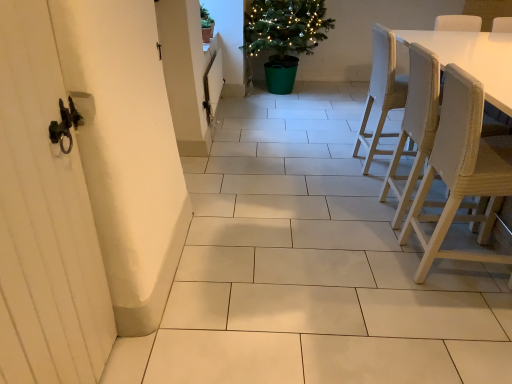
The width and height of the screenshot is (512, 384). What are the coordinates of `green matte pot at upper center, which is counted as the first houseplant, starting from the left` in the screenshot? It's located at (206, 25).

Locate an element on the screen. The height and width of the screenshot is (384, 512). light beige fabric chair at right, which is counted as the first chair, starting from the back is located at coordinates (381, 93).

What do you see at coordinates (44, 220) in the screenshot? The image size is (512, 384). I see `white wooden screen door at left` at bounding box center [44, 220].

Image resolution: width=512 pixels, height=384 pixels. What do you see at coordinates (462, 172) in the screenshot? I see `woven wood chair at right, marked as the 1th chair in a front-to-back arrangement` at bounding box center [462, 172].

What is the approximate width of light brown woven chair at right, which is the second chair from back to front?

20.02 inches.

Identify the location of light brown woven chair at right, which is counted as the 2th chair, starting from the front. This screenshot has width=512, height=384. (415, 126).

Locate an element on the screen. Image resolution: width=512 pixels, height=384 pixels. green plastic potted plant at upper center, which is the 1th houseplant in right-to-left order is located at coordinates (284, 36).

Where is `green matte pot at upper center, which is the 2th houseplant from back to front`? green matte pot at upper center, which is the 2th houseplant from back to front is located at coordinates (206, 25).

Who is smaller, light beige fabric chair at right, the 3th chair viewed from the front, or white wooden screen door at left?

With smaller size is white wooden screen door at left.

This screenshot has height=384, width=512. I want to click on the 1st chair to the right of the white wooden screen door at left, counting from the anchor's position, so click(381, 93).

How different are the orientations of light beige fabric chair at right, which is counted as the first chair, starting from the back, and white wooden screen door at left in degrees?

The angular difference between light beige fabric chair at right, which is counted as the first chair, starting from the back, and white wooden screen door at left is 2.22 degrees.

Can you confirm if green plastic potted plant at upper center, which is the 1th houseplant in right-to-left order, is taller than light beige fabric chair at right, the 3th chair viewed from the front?

Indeed, green plastic potted plant at upper center, which is the 1th houseplant in right-to-left order, has a greater height compared to light beige fabric chair at right, the 3th chair viewed from the front.

Does green plastic potted plant at upper center, placed as the second houseplant when sorted from left to right, turn towards light beige fabric chair at right, the 3th chair viewed from the front?

Yes, green plastic potted plant at upper center, placed as the second houseplant when sorted from left to right, is facing light beige fabric chair at right, the 3th chair viewed from the front.

Is green plastic potted plant at upper center, which is the 1th houseplant in right-to-left order, at the left side of light beige fabric chair at right, which is counted as the first chair, starting from the back?

Yes.

Based on the photo, is green plastic potted plant at upper center, placed as the second houseplant when sorted from left to right, surrounding light beige fabric chair at right, which is counted as the first chair, starting from the back?

No, green plastic potted plant at upper center, placed as the second houseplant when sorted from left to right, does not contain light beige fabric chair at right, which is counted as the first chair, starting from the back.

Is woven wood chair at right, the third chair in the back-to-front sequence, positioned far away from green matte pot at upper center, the second houseplant in the right-to-left sequence?

Indeed, woven wood chair at right, the third chair in the back-to-front sequence, is not near green matte pot at upper center, the second houseplant in the right-to-left sequence.

Is woven wood chair at right, the third chair in the back-to-front sequence, positioned beyond the bounds of green matte pot at upper center, which is counted as the first houseplant, starting from the left?

Indeed, woven wood chair at right, the third chair in the back-to-front sequence, is completely outside green matte pot at upper center, which is counted as the first houseplant, starting from the left.

Is woven wood chair at right, marked as the 1th chair in a front-to-back arrangement, turned away from green matte pot at upper center, which is counted as the first houseplant, starting from the left?

No, woven wood chair at right, marked as the 1th chair in a front-to-back arrangement,'s orientation is not away from green matte pot at upper center, which is counted as the first houseplant, starting from the left.

Looking at this image, which is nearer, (451, 212) or (205, 32)?

Clearly, point (451, 212) is closer to the camera than point (205, 32).

In terms of size, does green matte pot at upper center, which is counted as the first houseplant, starting from the left, appear bigger or smaller than white wooden screen door at left?

Considering their sizes, green matte pot at upper center, which is counted as the first houseplant, starting from the left, takes up less space than white wooden screen door at left.

Is green matte pot at upper center, the first houseplant from the front, far from white wooden screen door at left?

Yes.

Where is `the 1st houseplant behind the white wooden screen door at left, counting from the anchor's position`? the 1st houseplant behind the white wooden screen door at left, counting from the anchor's position is located at coordinates (206, 25).

Considering the sizes of objects light brown woven chair at right, which is counted as the 2th chair, starting from the front, and green plastic potted plant at upper center, the 1th houseplant viewed from the back, in the image provided, who is smaller, light brown woven chair at right, which is counted as the 2th chair, starting from the front, or green plastic potted plant at upper center, the 1th houseplant viewed from the back,?

light brown woven chair at right, which is counted as the 2th chair, starting from the front.

Looking at this image, between light brown woven chair at right, which is the second chair from back to front, and green plastic potted plant at upper center, the 1th houseplant viewed from the back, which one is positioned in front?

Positioned in front is light brown woven chair at right, which is the second chair from back to front.

Considering the relative positions of light brown woven chair at right, which is the second chair from back to front, and green plastic potted plant at upper center, the 1th houseplant viewed from the back, in the image provided, is light brown woven chair at right, which is the second chair from back to front, to the right of green plastic potted plant at upper center, the 1th houseplant viewed from the back, from the viewer's perspective?

Yes.

What's the angular difference between light brown woven chair at right, which is counted as the 2th chair, starting from the front, and green plastic potted plant at upper center, the 1th houseplant viewed from the back,'s facing directions?

91.6 degrees separate the facing orientations of light brown woven chair at right, which is counted as the 2th chair, starting from the front, and green plastic potted plant at upper center, the 1th houseplant viewed from the back.

How distant is white wooden screen door at left from green plastic potted plant at upper center, which is the 2th houseplant from front to back?

white wooden screen door at left and green plastic potted plant at upper center, which is the 2th houseplant from front to back, are 12.18 feet apart.

Is white wooden screen door at left thinner than green plastic potted plant at upper center, which is the 1th houseplant in right-to-left order?

Yes, white wooden screen door at left is thinner than green plastic potted plant at upper center, which is the 1th houseplant in right-to-left order.

Is white wooden screen door at left situated inside green plastic potted plant at upper center, which is the 1th houseplant in right-to-left order, or outside?

white wooden screen door at left lies outside green plastic potted plant at upper center, which is the 1th houseplant in right-to-left order.

Is white wooden screen door at left aimed at green plastic potted plant at upper center, which is the 1th houseplant in right-to-left order?

No, white wooden screen door at left is not turned towards green plastic potted plant at upper center, which is the 1th houseplant in right-to-left order.

Which is more to the right, green plastic potted plant at upper center, placed as the second houseplant when sorted from left to right, or white wooden screen door at left?

green plastic potted plant at upper center, placed as the second houseplant when sorted from left to right.

How far apart are green plastic potted plant at upper center, which is the 1th houseplant in right-to-left order, and white wooden screen door at left?

green plastic potted plant at upper center, which is the 1th houseplant in right-to-left order, is 3.71 meters from white wooden screen door at left.

Considering the sizes of objects green plastic potted plant at upper center, placed as the second houseplant when sorted from left to right, and white wooden screen door at left in the image provided, who is thinner, green plastic potted plant at upper center, placed as the second houseplant when sorted from left to right, or white wooden screen door at left?

white wooden screen door at left is thinner.

In the image, is green plastic potted plant at upper center, the 1th houseplant viewed from the back, positioned in front of or behind white wooden screen door at left?

green plastic potted plant at upper center, the 1th houseplant viewed from the back, is positioned farther from the viewer than white wooden screen door at left.

The image size is (512, 384). I want to click on the 3rd chair behind when counting from the white wooden screen door at left, so click(381, 93).

Image resolution: width=512 pixels, height=384 pixels. I want to click on the 2nd houseplant positioned above the light beige fabric chair at right, which is counted as the first chair, starting from the back (from the image's perspective), so click(x=284, y=36).

Based on their spatial positions, is green matte pot at upper center, the second houseplant in the right-to-left sequence, or light brown woven chair at right, which is the second chair from back to front, closer to light beige fabric chair at right, which is counted as the first chair, starting from the back?

light brown woven chair at right, which is the second chair from back to front.

In the scene shown: When comparing their distances from green matte pot at upper center, which is the 2th houseplant from back to front, does white wooden screen door at left or green plastic potted plant at upper center, which is the 2th houseplant from front to back, seem further?

white wooden screen door at left is further to green matte pot at upper center, which is the 2th houseplant from back to front.

Looking at the image, which one is located closer to green plastic potted plant at upper center, which is the 1th houseplant in right-to-left order, light beige fabric chair at right, the 3th chair viewed from the front, or green matte pot at upper center, the second houseplant in the right-to-left sequence?

Based on the image, green matte pot at upper center, the second houseplant in the right-to-left sequence, appears to be nearer to green plastic potted plant at upper center, which is the 1th houseplant in right-to-left order.

Which object lies nearer to the anchor point green matte pot at upper center, the first houseplant from the front, light beige fabric chair at right, which is counted as the first chair, starting from the back, or woven wood chair at right, marked as the 1th chair in a front-to-back arrangement?

light beige fabric chair at right, which is counted as the first chair, starting from the back, lies closer to green matte pot at upper center, the first houseplant from the front, than the other object.

From the image, which object appears to be farther from white wooden screen door at left, green matte pot at upper center, which is counted as the first houseplant, starting from the left, or woven wood chair at right, the third chair in the back-to-front sequence?

Based on the image, green matte pot at upper center, which is counted as the first houseplant, starting from the left, appears to be further to white wooden screen door at left.

Estimate the real-world distances between objects in this image. Which object is further from green plastic potted plant at upper center, the 1th houseplant viewed from the back, woven wood chair at right, the third chair in the back-to-front sequence, or green matte pot at upper center, which is the 2th houseplant from back to front?

woven wood chair at right, the third chair in the back-to-front sequence.

Which object lies nearer to the anchor point green plastic potted plant at upper center, the 1th houseplant viewed from the back, white wooden screen door at left or green matte pot at upper center, the second houseplant in the right-to-left sequence?

green matte pot at upper center, the second houseplant in the right-to-left sequence, is positioned closer to the anchor green plastic potted plant at upper center, the 1th houseplant viewed from the back.

Based on their spatial positions, is green matte pot at upper center, the second houseplant in the right-to-left sequence, or light beige fabric chair at right, the 3th chair viewed from the front, further from green plastic potted plant at upper center, the 1th houseplant viewed from the back?

light beige fabric chair at right, the 3th chair viewed from the front, lies further to green plastic potted plant at upper center, the 1th houseplant viewed from the back, than the other object.

Where is `chair between woven wood chair at right, marked as the 1th chair in a front-to-back arrangement, and light beige fabric chair at right, which is counted as the first chair, starting from the back, from front to back`? Image resolution: width=512 pixels, height=384 pixels. chair between woven wood chair at right, marked as the 1th chair in a front-to-back arrangement, and light beige fabric chair at right, which is counted as the first chair, starting from the back, from front to back is located at coordinates (415, 126).

Find the location of a particular element. The width and height of the screenshot is (512, 384). houseplant between white wooden screen door at left and green plastic potted plant at upper center, which is the 1th houseplant in right-to-left order, along the z-axis is located at coordinates [x=206, y=25].

Where is `chair between light brown woven chair at right, which is counted as the 2th chair, starting from the front, and green matte pot at upper center, the first houseplant from the front, along the z-axis`? This screenshot has height=384, width=512. chair between light brown woven chair at right, which is counted as the 2th chair, starting from the front, and green matte pot at upper center, the first houseplant from the front, along the z-axis is located at coordinates (381, 93).

Where is `houseplant between light beige fabric chair at right, the 3th chair viewed from the front, and green plastic potted plant at upper center, placed as the second houseplant when sorted from left to right, in the front-back direction`? This screenshot has height=384, width=512. houseplant between light beige fabric chair at right, the 3th chair viewed from the front, and green plastic potted plant at upper center, placed as the second houseplant when sorted from left to right, in the front-back direction is located at coordinates (206, 25).